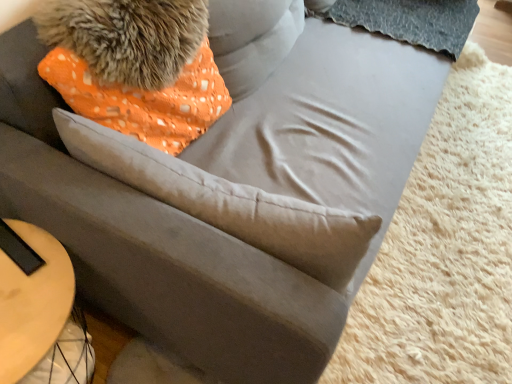
Question: From the image's perspective, is fuzzy fur at upper left below light wood table at lower left?

Choices:
 (A) yes
 (B) no

Answer: (B)

Question: Considering the relative positions of fuzzy fur at upper left and light wood table at lower left in the image provided, is fuzzy fur at upper left to the left of light wood table at lower left from the viewer's perspective?

Choices:
 (A) yes
 (B) no

Answer: (B)

Question: Is fuzzy fur at upper left oriented towards light wood table at lower left?

Choices:
 (A) yes
 (B) no

Answer: (B)

Question: Can you confirm if fuzzy fur at upper left is smaller than light wood table at lower left?

Choices:
 (A) no
 (B) yes

Answer: (B)

Question: Considering the relative positions of fuzzy fur at upper left and light wood table at lower left in the image provided, is fuzzy fur at upper left behind light wood table at lower left?

Choices:
 (A) no
 (B) yes

Answer: (B)

Question: Is fuzzy fur at upper left surrounding light wood table at lower left?

Choices:
 (A) no
 (B) yes

Answer: (A)

Question: Is light wood table at lower left closer to camera compared to fuzzy fur at upper left?

Choices:
 (A) no
 (B) yes

Answer: (B)

Question: From a real-world perspective, is light wood table at lower left below fuzzy fur at upper left?

Choices:
 (A) no
 (B) yes

Answer: (B)

Question: Would you say light wood table at lower left is a long distance from fuzzy fur at upper left?

Choices:
 (A) no
 (B) yes

Answer: (A)

Question: From the image's perspective, would you say light wood table at lower left is positioned over fuzzy fur at upper left?

Choices:
 (A) yes
 (B) no

Answer: (B)

Question: Is fuzzy fur at upper left inside light wood table at lower left?

Choices:
 (A) yes
 (B) no

Answer: (B)

Question: Does light wood table at lower left have a greater height compared to fuzzy fur at upper left?

Choices:
 (A) no
 (B) yes

Answer: (B)

Question: Is there a large distance between orange dotted fabric pillow at upper left and fuzzy fur at upper left?

Choices:
 (A) yes
 (B) no

Answer: (B)